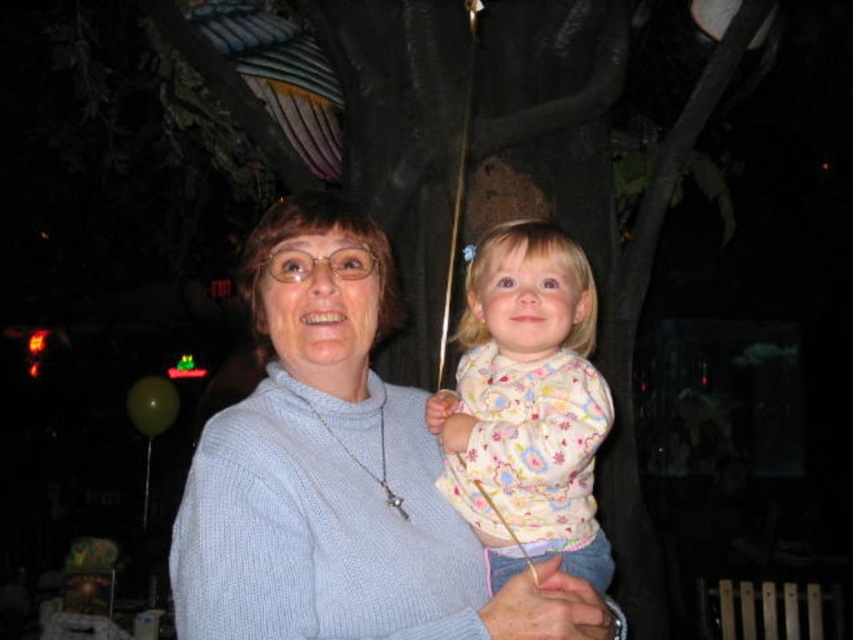
Question: Does light blue sweater at center appear on the right side of fluffy cotton sweater at center?

Choices:
 (A) yes
 (B) no

Answer: (B)

Question: Which of the following is the farthest from the observer?

Choices:
 (A) light blue sweater at center
 (B) fluffy cotton sweater at center

Answer: (B)

Question: Is light blue sweater at center to the left of fluffy cotton sweater at center from the viewer's perspective?

Choices:
 (A) no
 (B) yes

Answer: (B)

Question: Does light blue sweater at center appear on the right side of fluffy cotton sweater at center?

Choices:
 (A) yes
 (B) no

Answer: (B)

Question: Among these points, which one is farthest from the camera?

Choices:
 (A) (396, 385)
 (B) (490, 420)

Answer: (A)